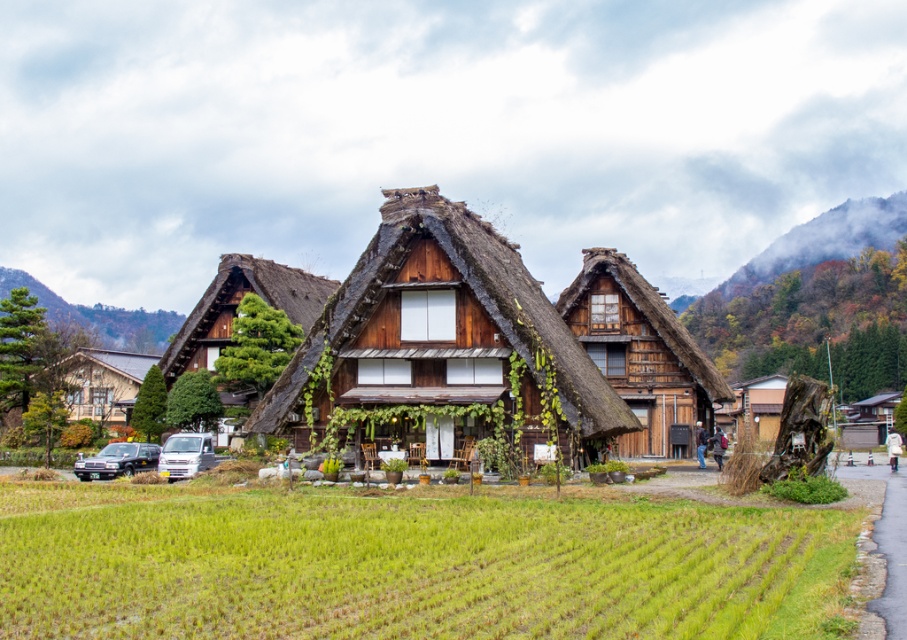
Is thatched wood cottage at center wider than wooden cottage at left?

Indeed, thatched wood cottage at center has a greater width compared to wooden cottage at left.

Can you confirm if thatched wood cottage at center is positioned below wooden cottage at left?

No.

Does point (475, 316) lie in front of point (132, 371)?

Yes, point (475, 316) is in front of point (132, 371).

Locate an element on the screen. The height and width of the screenshot is (640, 907). thatched wood cottage at center is located at coordinates (439, 344).

Can you confirm if thatched wood cottage at center is positioned to the right of matte black suv at lower left?

Yes, thatched wood cottage at center is to the right of matte black suv at lower left.

Does thatched wood cottage at center have a lesser height compared to matte black suv at lower left?

No.

Is point (366, 244) in front of point (76, 461)?

No, (366, 244) is further to viewer.

This screenshot has height=640, width=907. I want to click on thatched wood cottage at center, so click(x=439, y=344).

Can you confirm if green grassy field at lower center is thinner than wooden thatched cottage at center?

No.

Can you confirm if green grassy field at lower center is positioned below wooden thatched cottage at center?

Correct, green grassy field at lower center is located below wooden thatched cottage at center.

Is point (447, 500) behind point (621, 259)?

No, it is in front of (621, 259).

Image resolution: width=907 pixels, height=640 pixels. I want to click on green grassy field at lower center, so tap(412, 564).